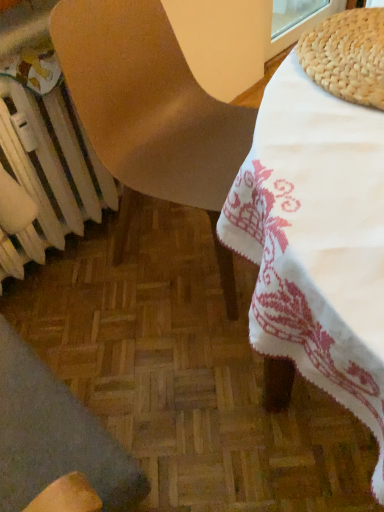
Question: From a real-world perspective, is matte brown chair at center, which is the 2th chair from bottom to top, located beneath white metallic radiator at lower left?

Choices:
 (A) yes
 (B) no

Answer: (B)

Question: From the image's perspective, is matte brown chair at center, which is the 2th chair from bottom to top, below white metallic radiator at lower left?

Choices:
 (A) yes
 (B) no

Answer: (B)

Question: Can you confirm if matte brown chair at center, which is the 2th chair from bottom to top, is smaller than white metallic radiator at lower left?

Choices:
 (A) no
 (B) yes

Answer: (A)

Question: Considering the relative sizes of matte brown chair at center, marked as the 1th chair in a top-to-bottom arrangement, and white metallic radiator at lower left in the image provided, is matte brown chair at center, marked as the 1th chair in a top-to-bottom arrangement, thinner than white metallic radiator at lower left?

Choices:
 (A) yes
 (B) no

Answer: (B)

Question: Does matte brown chair at center, marked as the 1th chair in a top-to-bottom arrangement, come behind white metallic radiator at lower left?

Choices:
 (A) yes
 (B) no

Answer: (B)

Question: Is matte brown chair at center, marked as the 1th chair in a top-to-bottom arrangement, oriented towards white metallic radiator at lower left?

Choices:
 (A) no
 (B) yes

Answer: (A)

Question: From a real-world perspective, is white metallic radiator at lower left located beneath matte brown chair at center, marked as the 1th chair in a top-to-bottom arrangement?

Choices:
 (A) no
 (B) yes

Answer: (B)

Question: Does white metallic radiator at lower left have a larger size compared to matte brown chair at center, which is the 2th chair from bottom to top?

Choices:
 (A) no
 (B) yes

Answer: (A)

Question: Is white metallic radiator at lower left looking in the opposite direction of matte brown chair at center, which is the 2th chair from bottom to top?

Choices:
 (A) no
 (B) yes

Answer: (A)

Question: Is white metallic radiator at lower left thinner than matte brown chair at center, which is the 2th chair from bottom to top?

Choices:
 (A) yes
 (B) no

Answer: (A)

Question: Considering the relative positions of white metallic radiator at lower left and matte brown chair at center, which is the 2th chair from bottom to top, in the image provided, is white metallic radiator at lower left in front of matte brown chair at center, which is the 2th chair from bottom to top,?

Choices:
 (A) no
 (B) yes

Answer: (A)

Question: Is white metallic radiator at lower left surrounding matte brown chair at center, which is the 2th chair from bottom to top?

Choices:
 (A) yes
 (B) no

Answer: (B)

Question: From the image's perspective, would you say matte brown chair at center, which is the 2th chair from bottom to top, is shown under wooden chair at lower left, which appears as the first chair when ordered from the bottom?

Choices:
 (A) yes
 (B) no

Answer: (B)